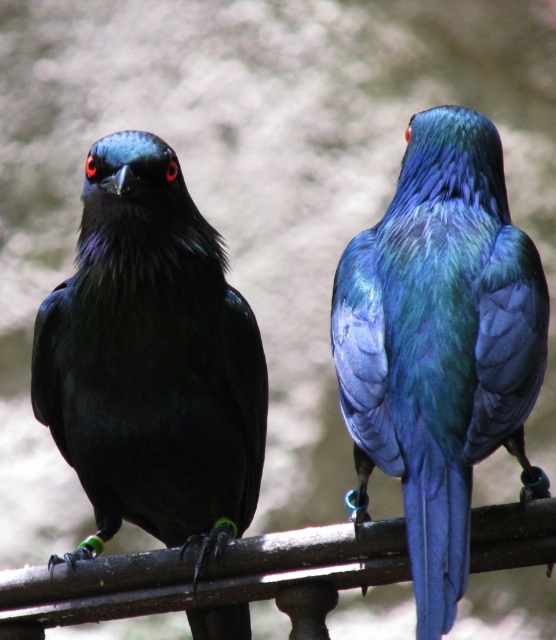
Question: Can you confirm if shiny black bird at left is thinner than metallic blue bird at right?

Choices:
 (A) no
 (B) yes

Answer: (A)

Question: Can you confirm if shiny black bird at left is thinner than metallic blue bird at right?

Choices:
 (A) yes
 (B) no

Answer: (B)

Question: Is shiny black bird at left wider than metallic blue bird at right?

Choices:
 (A) no
 (B) yes

Answer: (B)